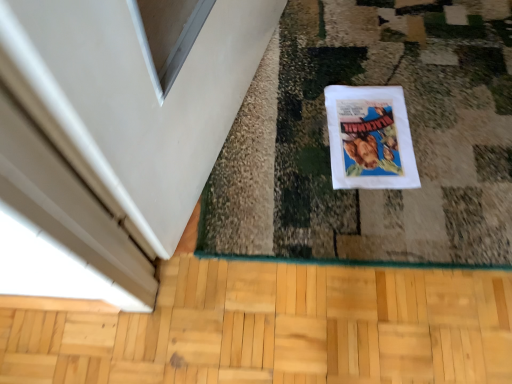
Question: Does white paper comic book at center appear on the left side of light brown wood flooring at lower center?

Choices:
 (A) yes
 (B) no

Answer: (B)

Question: Is light brown wood flooring at lower center at the back of white paper comic book at center?

Choices:
 (A) yes
 (B) no

Answer: (B)

Question: From the image's perspective, is white paper comic book at center over light brown wood flooring at lower center?

Choices:
 (A) no
 (B) yes

Answer: (B)

Question: Is white paper comic book at center at the right side of light brown wood flooring at lower center?

Choices:
 (A) yes
 (B) no

Answer: (A)

Question: Is white paper comic book at center facing towards light brown wood flooring at lower center?

Choices:
 (A) yes
 (B) no

Answer: (A)

Question: Considering the relative sizes of white paper comic book at center and light brown wood flooring at lower center in the image provided, is white paper comic book at center taller than light brown wood flooring at lower center?

Choices:
 (A) yes
 (B) no

Answer: (B)

Question: Does light brown wood flooring at lower center lie behind white paper comic book at center?

Choices:
 (A) yes
 (B) no

Answer: (B)

Question: Does light brown wood flooring at lower center have a smaller size compared to white paper comic book at center?

Choices:
 (A) no
 (B) yes

Answer: (A)

Question: Can you confirm if light brown wood flooring at lower center is wider than white paper comic book at center?

Choices:
 (A) yes
 (B) no

Answer: (B)

Question: Can you confirm if light brown wood flooring at lower center is positioned to the right of white paper comic book at center?

Choices:
 (A) no
 (B) yes

Answer: (A)

Question: From a real-world perspective, does light brown wood flooring at lower center sit lower than white paper comic book at center?

Choices:
 (A) no
 (B) yes

Answer: (B)

Question: Is light brown wood flooring at lower center completely or partially outside of white paper comic book at center?

Choices:
 (A) no
 (B) yes

Answer: (B)

Question: From a real-world perspective, is white paper comic book at center positioned above or below light brown wood flooring at lower center?

Choices:
 (A) above
 (B) below

Answer: (A)